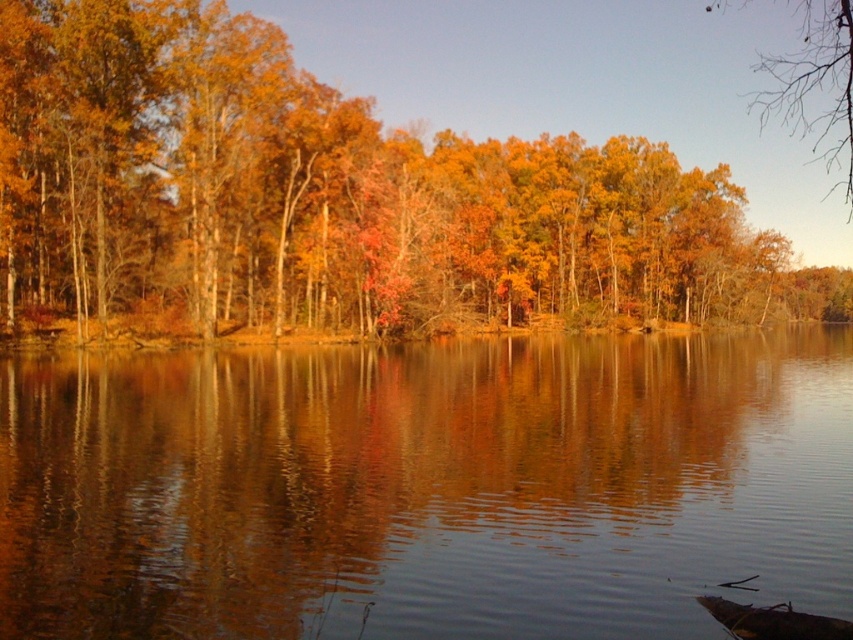
Is golden leaves at upper center positioned at the back of bare branches at upper right?

No, it is not.

Which of these two, golden leaves at upper center or bare branches at upper right, stands taller?

Standing taller between the two is bare branches at upper right.

Between point (531, 189) and point (844, 67), which one is positioned in front?

Point (531, 189)

Locate an element on the screen. Image resolution: width=853 pixels, height=640 pixels. golden leaves at upper center is located at coordinates pos(328,196).

Does shiny reflective water at center have a lesser width compared to bare branches at upper right?

Correct, shiny reflective water at center's width is less than bare branches at upper right's.

Is shiny reflective water at center positioned before bare branches at upper right?

Yes.

Locate an element on the screen. This screenshot has height=640, width=853. shiny reflective water at center is located at coordinates (426, 486).

Which is more to the left, shiny reflective water at center or golden leaves at upper center?

shiny reflective water at center

Is shiny reflective water at center closer to the viewer compared to golden leaves at upper center?

Yes, shiny reflective water at center is in front of golden leaves at upper center.

Between point (4, 531) and point (263, 58), which one is positioned in front?

Point (4, 531) is in front.

At what (x,y) coordinates should I click in order to perform the action: click on shiny reflective water at center. Please return your answer as a coordinate pair (x, y). The height and width of the screenshot is (640, 853). Looking at the image, I should click on (426, 486).